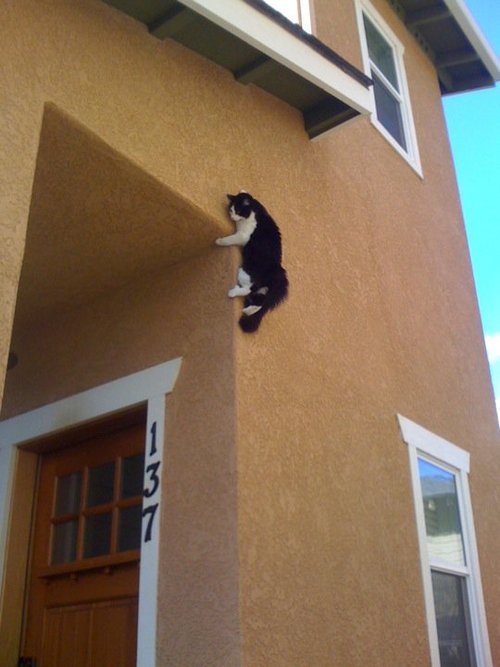
You are a GUI agent. You are given a task and a screenshot of the screen. Output one action in this format:
    pyautogui.click(x=<x>, y=<y>)
    Task: Click on the door
    The height and width of the screenshot is (667, 500).
    Given the screenshot: What is the action you would take?
    [96, 610]